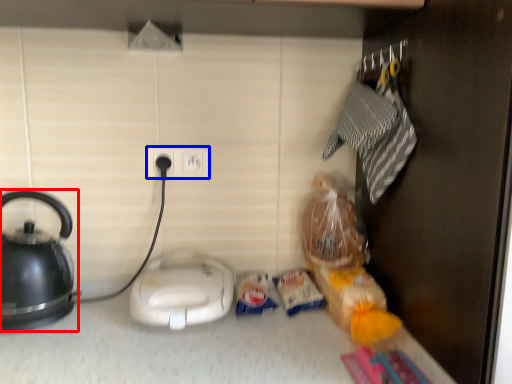
Question: Among these objects, which one is nearest to the camera, kettle (highlighted by a red box) or power plugs and sockets (highlighted by a blue box)?

Choices:
 (A) kettle
 (B) power plugs and sockets

Answer: (A)